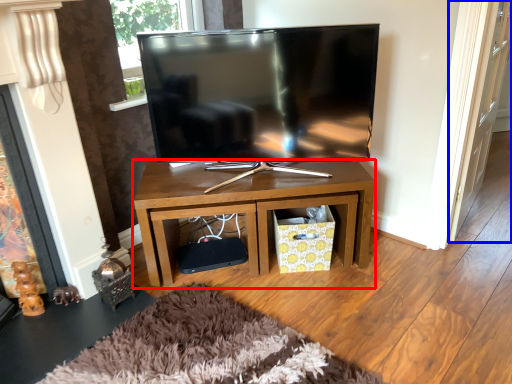
Question: Which point is closer to the camera, desk (highlighted by a red box) or glass door (highlighted by a blue box)?

Choices:
 (A) desk
 (B) glass door

Answer: (B)